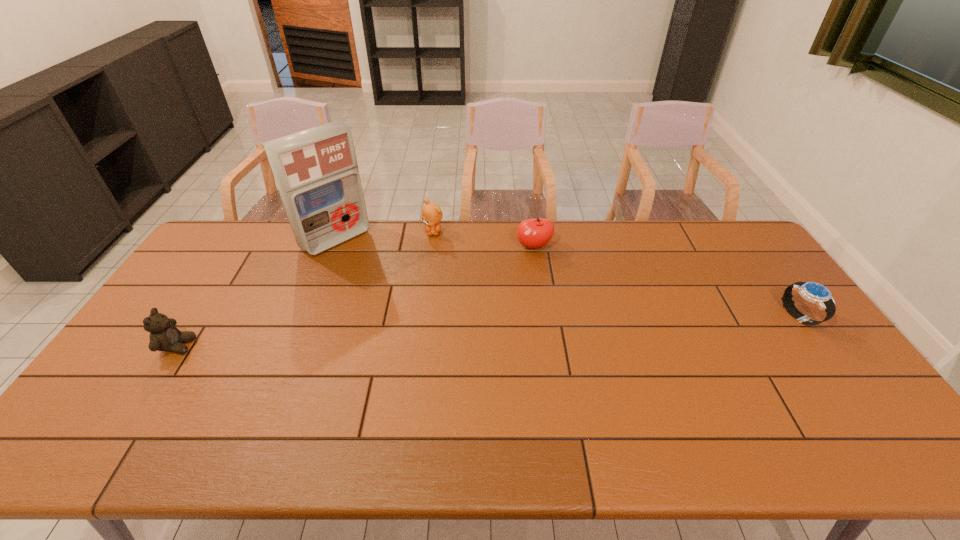
Find the location of a particular element. This screenshot has width=960, height=540. apple at the far edge is located at coordinates (533, 233).

Identify the location of teddy bear located in the far edge section of the desktop. (431, 213).

Where is `the first-aid kit at the far edge`? The height and width of the screenshot is (540, 960). the first-aid kit at the far edge is located at coordinates (316, 171).

At what (x,y) coordinates should I click in order to perform the action: click on object located at the left edge. Please return your answer as a coordinate pair (x, y). This screenshot has width=960, height=540. Looking at the image, I should click on (164, 336).

Locate an element on the screen. object at the right edge is located at coordinates (813, 292).

The width and height of the screenshot is (960, 540). I want to click on vacant region at the far edge, so click(513, 225).

Locate an element on the screen. free region at the near edge is located at coordinates (548, 393).

In the image, there is a desktop. At what (x,y) coordinates should I click in order to perform the action: click on vacant space at the left edge. Please return your answer as a coordinate pair (x, y). This screenshot has height=540, width=960. Looking at the image, I should click on (192, 275).

At what (x,y) coordinates should I click in order to perform the action: click on free space at the right edge. Please return your answer as a coordinate pair (x, y). The width and height of the screenshot is (960, 540). Looking at the image, I should click on (763, 298).

Locate an element on the screen. free region at the far left corner of the desktop is located at coordinates (225, 259).